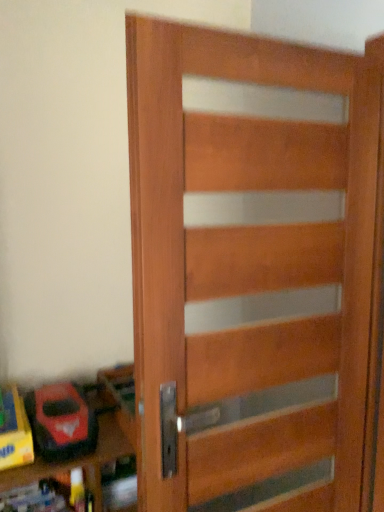
Question: Relative to wooden toy box at lower left, is wooden door at center in front or behind?

Choices:
 (A) front
 (B) behind

Answer: (A)

Question: Is point (210, 175) closer or farther from the camera than point (41, 468)?

Choices:
 (A) closer
 (B) farther

Answer: (A)

Question: Based on their relative distances, which object is nearer to the rubberized red toy car at lower left?

Choices:
 (A) wooden toy box at lower left
 (B) wooden door at center

Answer: (A)

Question: Considering the real-world distances, which object is farthest from the rubberized red toy car at lower left?

Choices:
 (A) wooden door at center
 (B) wooden toy box at lower left

Answer: (A)